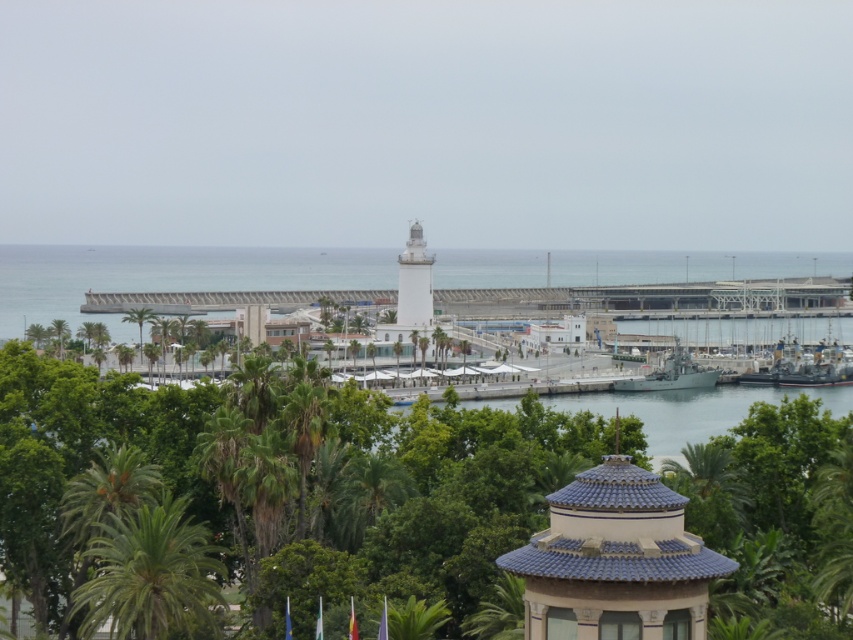
You are a photographer planning to capture the white smooth lighthouse at center and the green leafy palm tree at lower left in a single shot. Based on their sizes, which object would appear smaller in the photo?

The green leafy palm tree at lower left would appear smaller in the photo because it has a lesser width compared to the white smooth lighthouse at center.

You are standing at the waterfront near the lighthouse and want to reach the point marked at coordinates point (117, 627). If you walk straight ahead, will you reach this point before walking 100 meters?

The point (117, 627) is 77.14 meters away from the viewer, so yes, you will reach it before walking 100 meters.